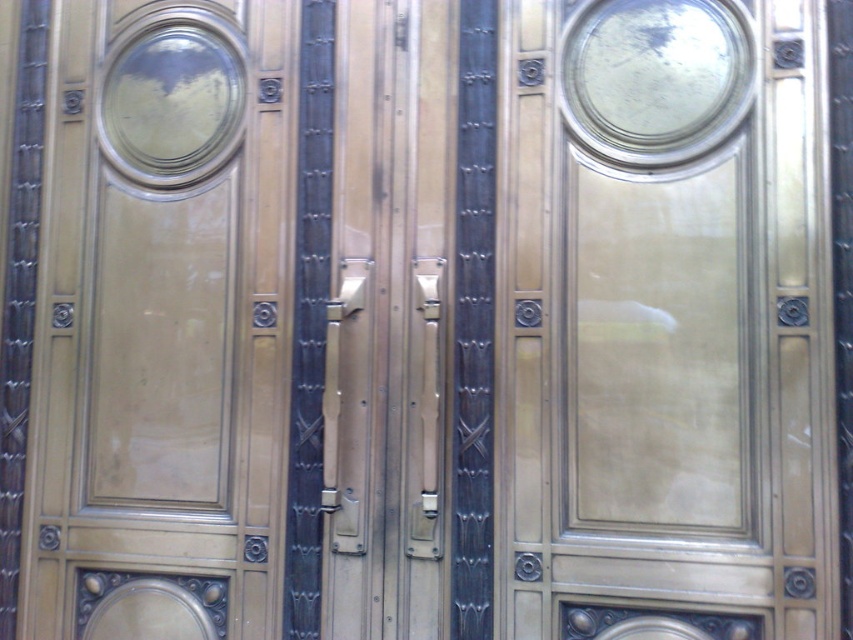
Is point (612, 401) less distant than point (80, 541)?

That is True.

Who is positioned more to the right, matte gold glass door at center or metallic gold door at left?

matte gold glass door at center

This screenshot has height=640, width=853. What do you see at coordinates (665, 321) in the screenshot?
I see `matte gold glass door at center` at bounding box center [665, 321].

This screenshot has height=640, width=853. In order to click on matte gold glass door at center in this screenshot , I will do click(665, 321).